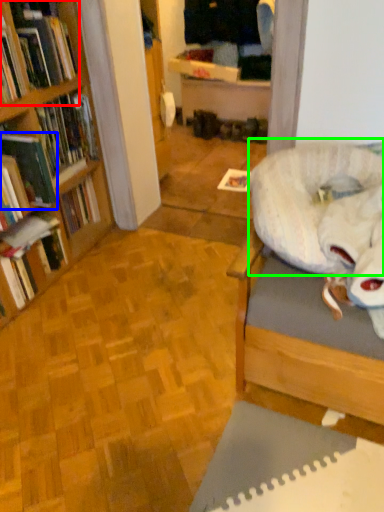
Question: Estimate the real-world distances between objects in this image. Which object is farther from book (highlighted by a red box), book (highlighted by a blue box) or bean bag chair (highlighted by a green box)?

Choices:
 (A) book
 (B) bean bag chair

Answer: (B)